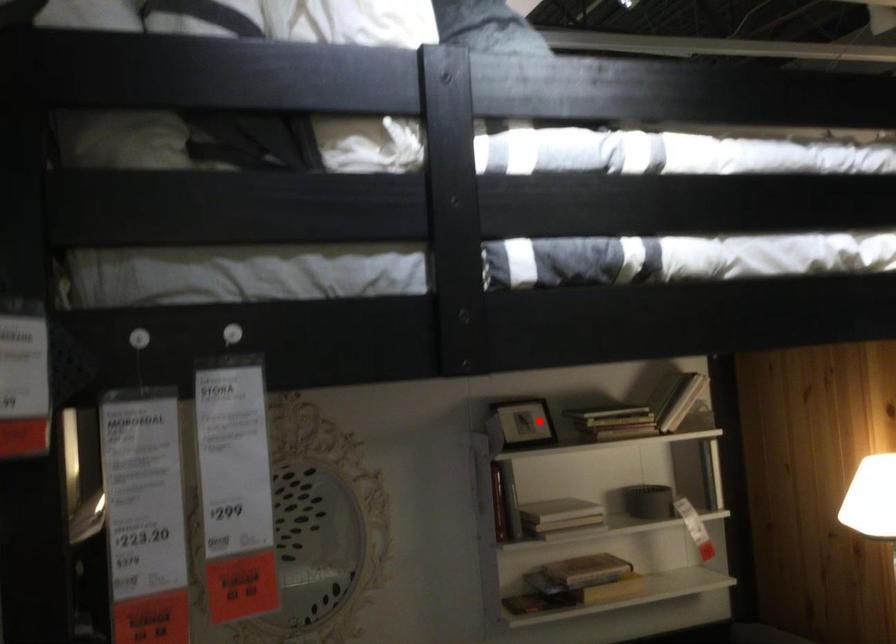
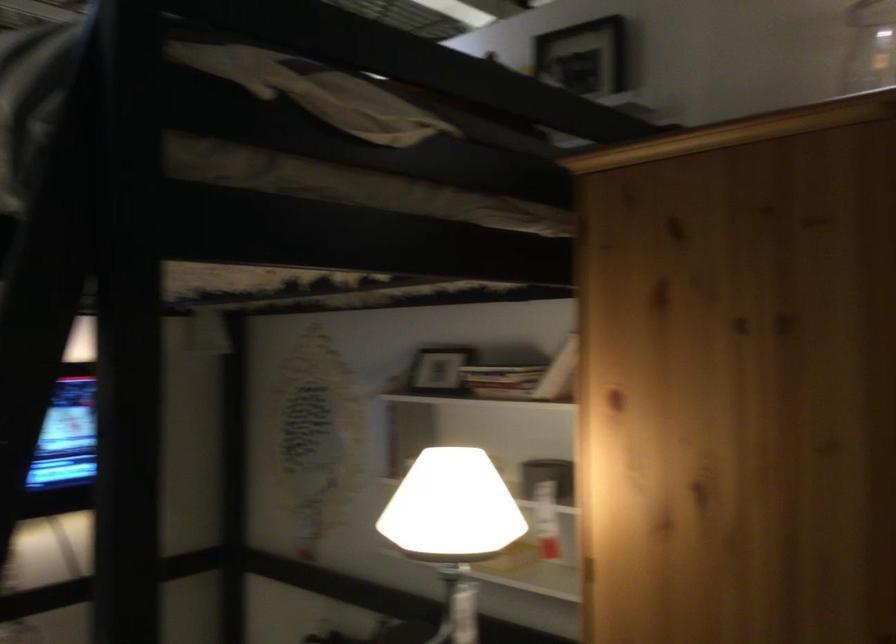
Find the pixel in the second image that matches the highlighted location in the first image.

(435, 372)